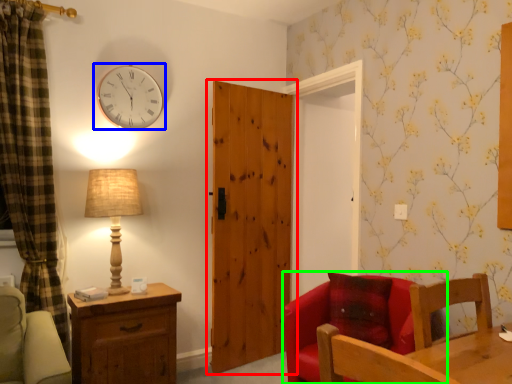
Question: Which object is the closest to the door (highlighted by a red box)? Choose among these: wall clock (highlighted by a blue box) or chair (highlighted by a green box).

Choices:
 (A) wall clock
 (B) chair

Answer: (A)